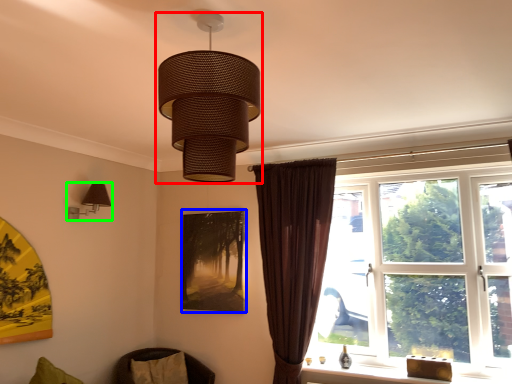
Question: Which is farther away from lamp (highlighted by a red box)? picture frame (highlighted by a blue box) or lamp (highlighted by a green box)?

Choices:
 (A) picture frame
 (B) lamp

Answer: (A)